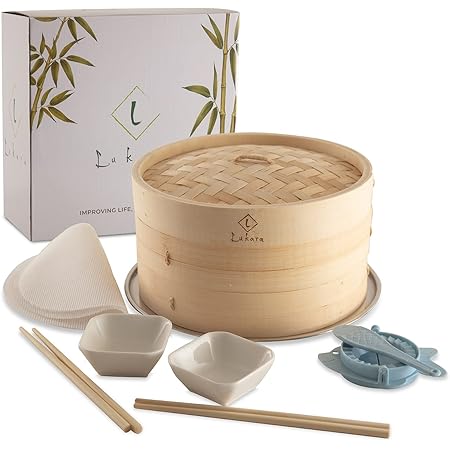
The image size is (450, 450). What are the coordinates of `tray` in the screenshot? It's located at (373, 294).